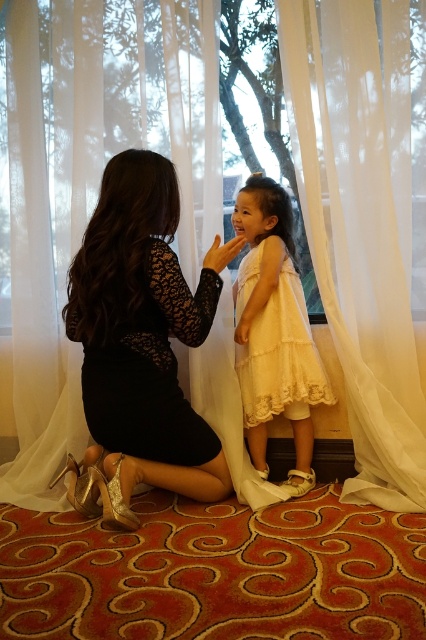
You are standing in the room and want to reach the black lace dress at center without touching the white sheer curtain at center. Is this possible?

The white sheer curtain at center is further to the viewer than black lace dress at center, so the dress is closer to you. You can reach the black lace dress at center without touching the curtain since it is closer.

You are a photographer setting up a shoot in this room. You want to ensure the black lace dress at center is fully visible in the photo. Given the white sheer curtain at center is currently blocking part of it, what adjustment should you make?

The white sheer curtain at center is positioned over the black lace dress at center. To make the black lace dress at center fully visible, you should move the white sheer curtain at center aside or adjust its position so it no longer covers the dress.

In the image, there is a black lace dress at center and a point marked at coordinates (x=150, y=368). Can you tell me which one is located at the specified coordinates?

The point marked at coordinates (x=150, y=368) corresponds to the black lace dress at center.